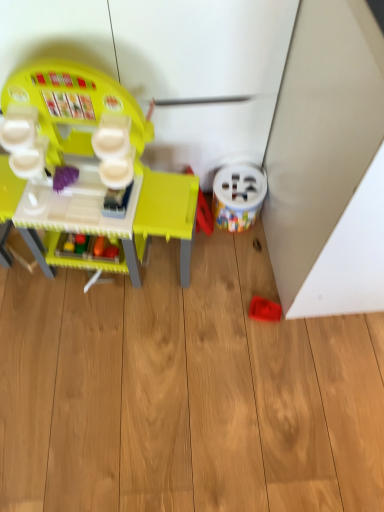
At what (x,y) coordinates should I click in order to perform the action: click on free space on the front side of white plastic bucket at lower right, the second toy viewed from the right. Please return your answer as a coordinate pair (x, y). The width and height of the screenshot is (384, 512). Looking at the image, I should click on pos(234,257).